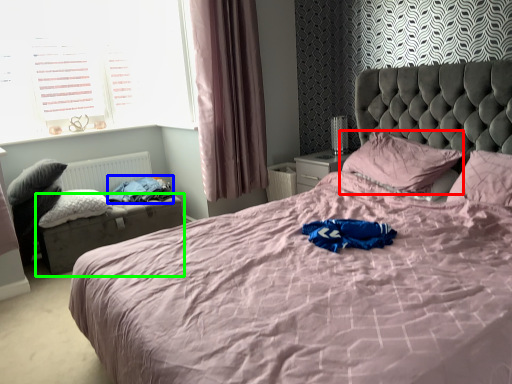
Question: Which object is the closest to the pillow (highlighted by a red box)? Choose among these: clothing (highlighted by a blue box) or bed frame (highlighted by a green box).

Choices:
 (A) clothing
 (B) bed frame

Answer: (A)